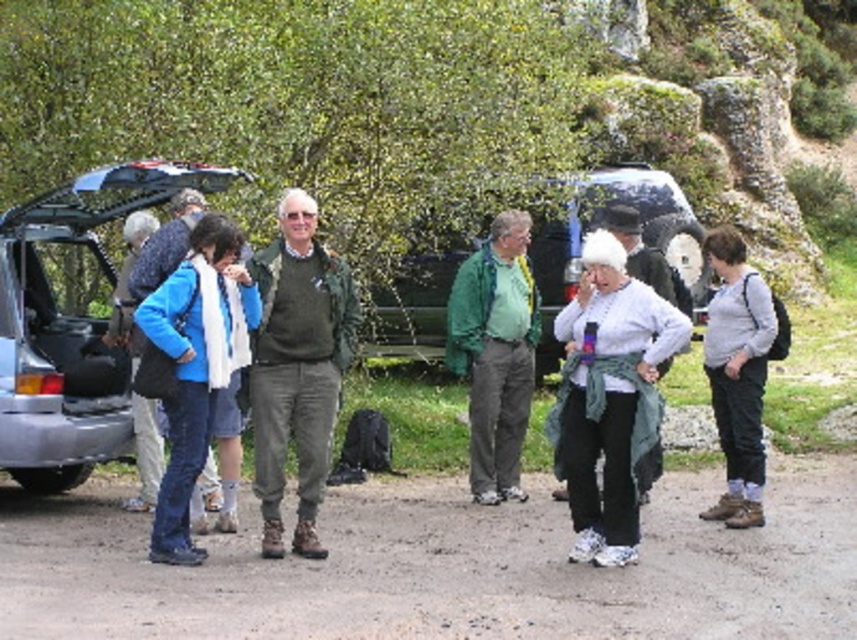
You are standing at the origin point of the coordinate system. The metallic silver minivan at center is located at point (598, 224). If you want to walk directly to the metallic silver minivan at center, which direction should you head?

The metallic silver minivan at center is located at point (598, 224), so you should head northeast to reach it.